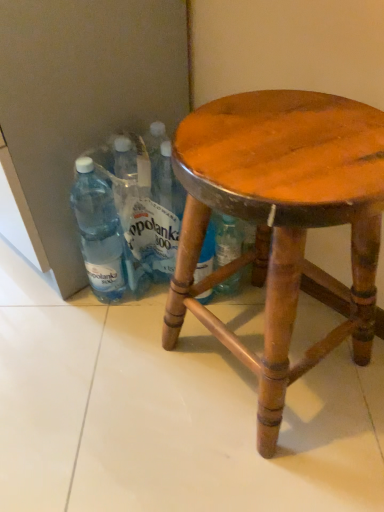
Question: Would you say transparent plastic bottles at lower left is part of wooden stool at center's contents?

Choices:
 (A) yes
 (B) no

Answer: (B)

Question: Can you confirm if wooden stool at center is positioned to the left of transparent plastic bottles at lower left?

Choices:
 (A) no
 (B) yes

Answer: (A)

Question: Can you confirm if wooden stool at center is shorter than transparent plastic bottles at lower left?

Choices:
 (A) yes
 (B) no

Answer: (B)

Question: Can you confirm if wooden stool at center is bigger than transparent plastic bottles at lower left?

Choices:
 (A) no
 (B) yes

Answer: (B)

Question: Would you say wooden stool at center is a long distance from transparent plastic bottles at lower left?

Choices:
 (A) yes
 (B) no

Answer: (B)

Question: From a real-world perspective, is wooden stool at center positioned over transparent plastic bottles at lower left based on gravity?

Choices:
 (A) no
 (B) yes

Answer: (B)

Question: Is transparent plastic bottles at lower left facing away from wooden stool at center?

Choices:
 (A) yes
 (B) no

Answer: (B)

Question: Does transparent plastic bottles at lower left have a larger size compared to wooden stool at center?

Choices:
 (A) yes
 (B) no

Answer: (B)

Question: Does transparent plastic bottles at lower left appear on the left side of wooden stool at center?

Choices:
 (A) no
 (B) yes

Answer: (B)

Question: Does transparent plastic bottles at lower left appear on the right side of wooden stool at center?

Choices:
 (A) yes
 (B) no

Answer: (B)

Question: From the image's perspective, would you say transparent plastic bottles at lower left is shown under wooden stool at center?

Choices:
 (A) no
 (B) yes

Answer: (A)

Question: From a real-world perspective, is transparent plastic bottles at lower left located beneath wooden stool at center?

Choices:
 (A) yes
 (B) no

Answer: (A)

Question: Is transparent plastic bottle at left far away from wooden stool at center?

Choices:
 (A) no
 (B) yes

Answer: (A)